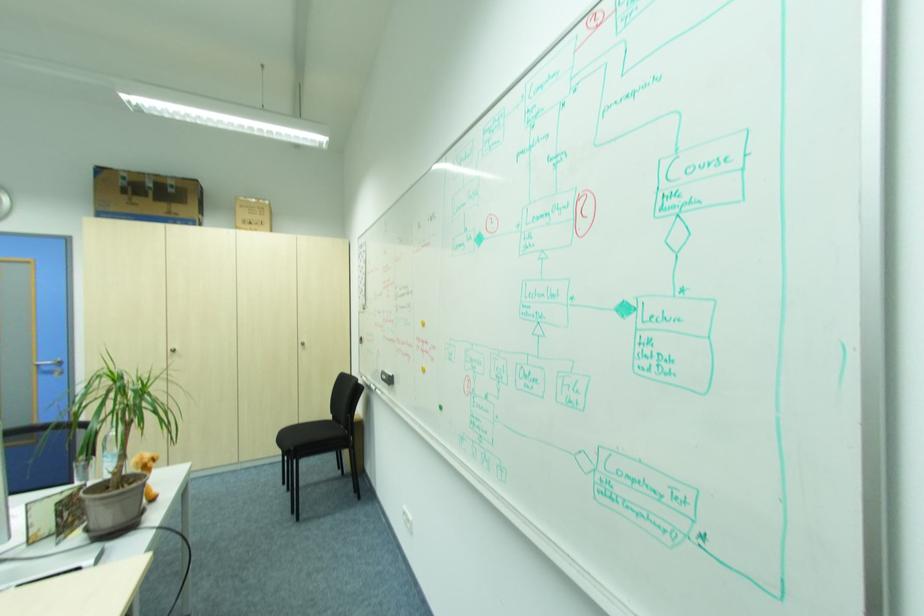
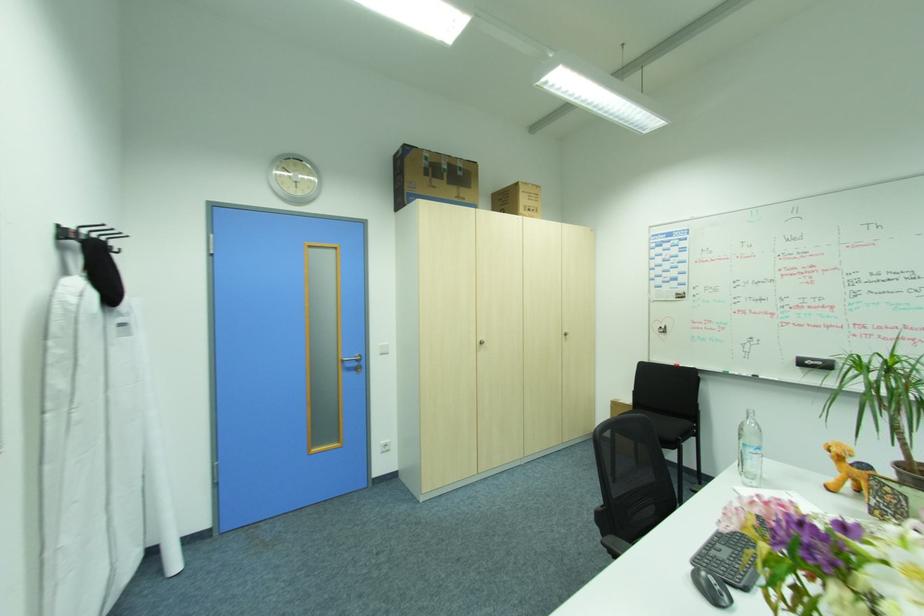
Locate, in the second image, the point that corresponds to point (176, 192) in the first image.

(465, 172)